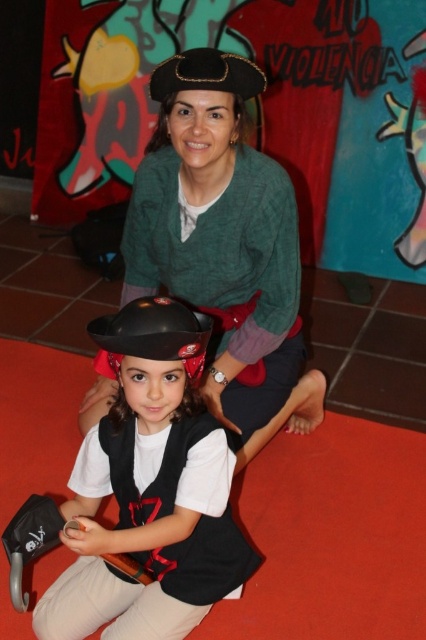
Does matte green sweater at center have a greater height compared to shiny black helmet at lower left?

Indeed, matte green sweater at center has a greater height compared to shiny black helmet at lower left.

Looking at this image, who is positioned more to the right, matte green sweater at center or shiny black helmet at lower left?

From the viewer's perspective, matte green sweater at center appears more on the right side.

Does point (201, 54) lie in front of point (124, 428)?

No, it is not.

The height and width of the screenshot is (640, 426). In order to click on matte green sweater at center in this screenshot , I will do `click(224, 244)`.